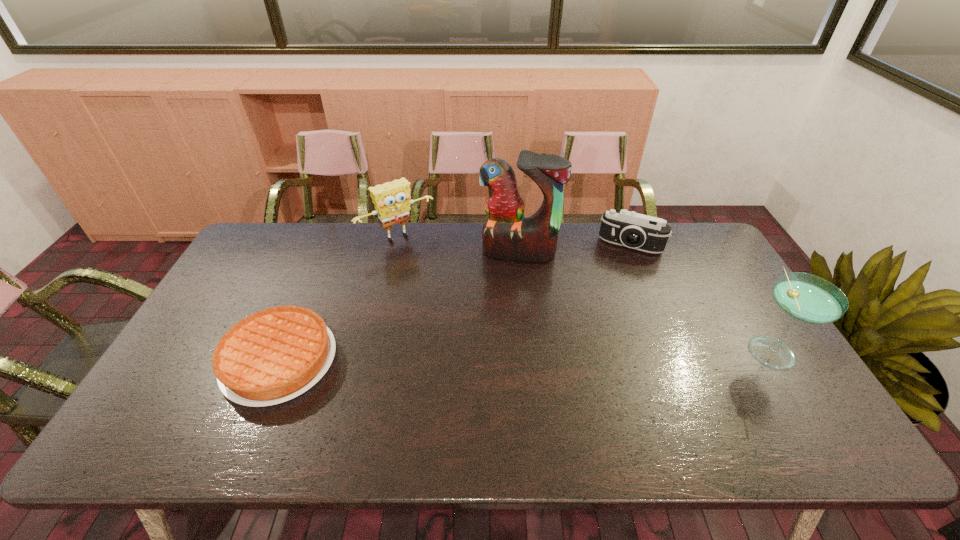
This screenshot has width=960, height=540. I want to click on free space on the desktop that is between the shortest object and the martini and is positioned at the face of the parrot, so click(494, 355).

Find the location of `free spot on the desktop that is between the pie and the martini and is positioned on the face of the sponge`. free spot on the desktop that is between the pie and the martini and is positioned on the face of the sponge is located at coordinates pyautogui.click(x=493, y=356).

Locate an element on the screen. The width and height of the screenshot is (960, 540). vacant space on the desktop that is between the pie and the martini and is positioned on the front lens of the second shortest object is located at coordinates (593, 353).